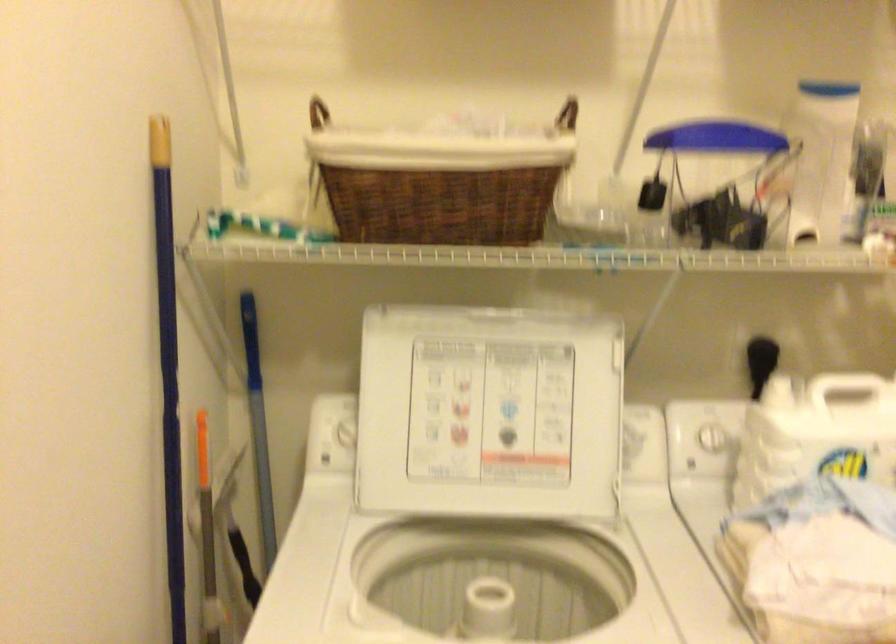
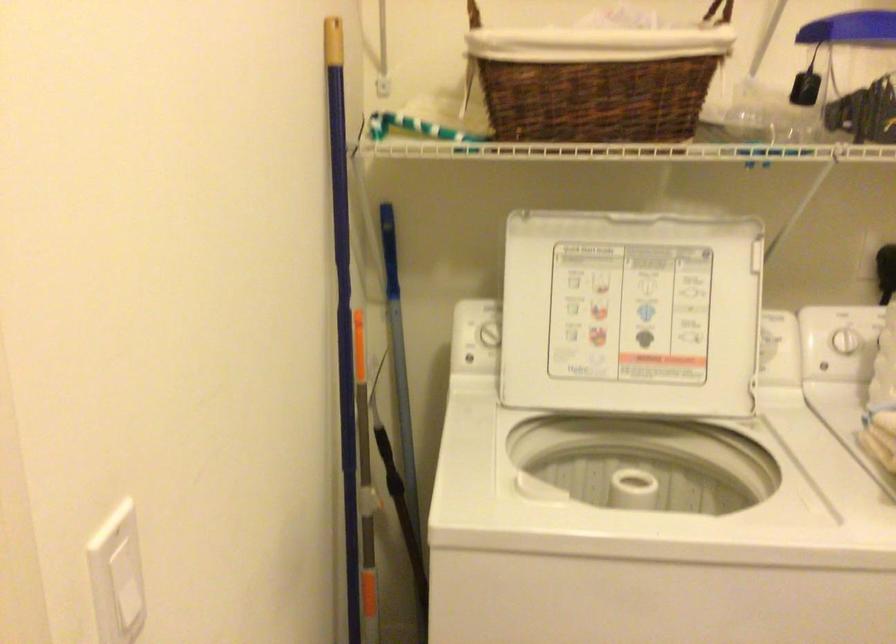
Where in the second image is the point corresponding to (x=173, y=422) from the first image?

(343, 316)